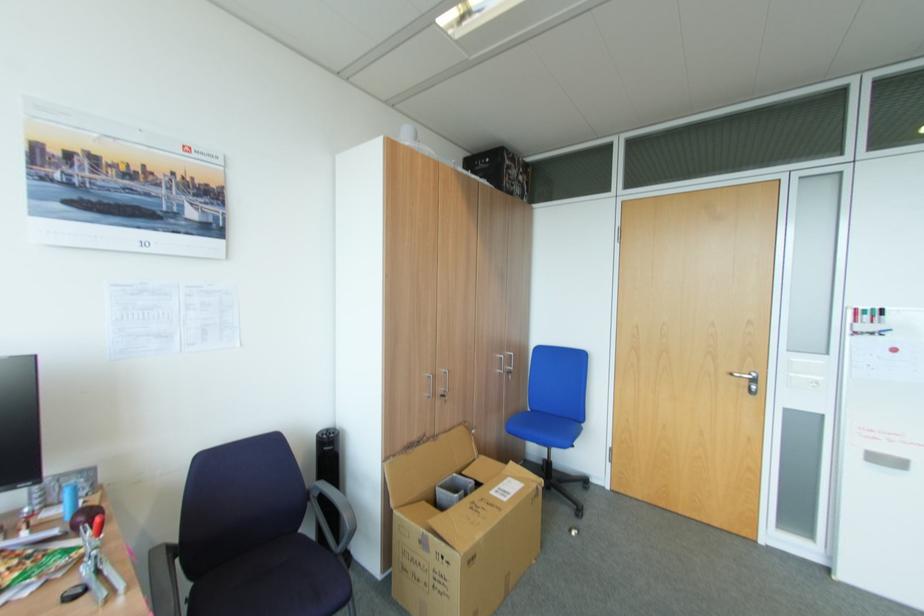
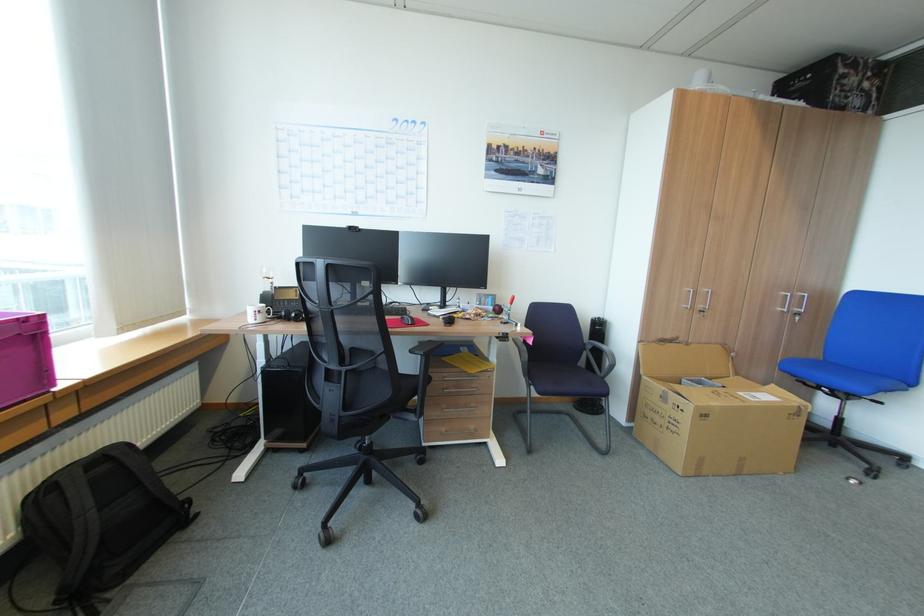
Where in the second image is the point corresponding to (440,394) from the first image?

(698, 307)